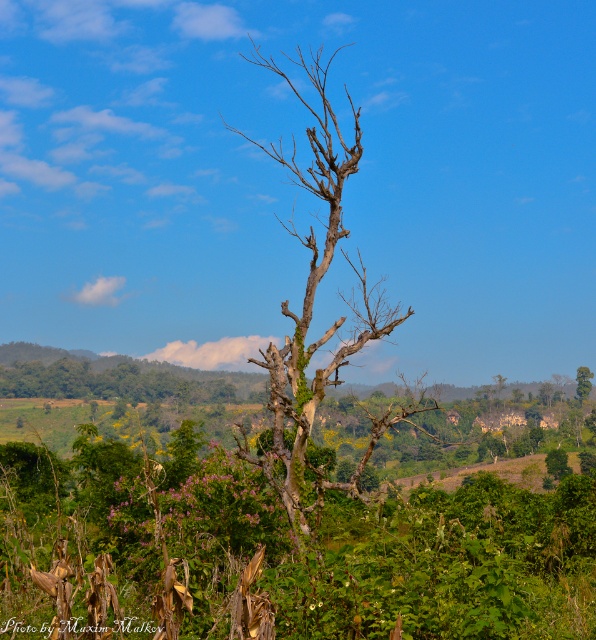
From the picture: You are standing at the point marked by point [311,316] in the image. Looking around, you see the bare wood tree at center. What is the most prominent object directly in front of you?

The point [311,316] marks the bare wood tree at center, so the most prominent object directly in front of you is the bare wood tree at center.

You are standing in the serene landscape and want to walk from the point at coordinates point (330, 380) to the point at coordinates point (581, 401). Since you can only move forward, will you pass in front of or behind the prominent leafless tree during your journey?

Since point (330, 380) is in front of point (581, 401), you will pass in front of the prominent leafless tree during your journey.